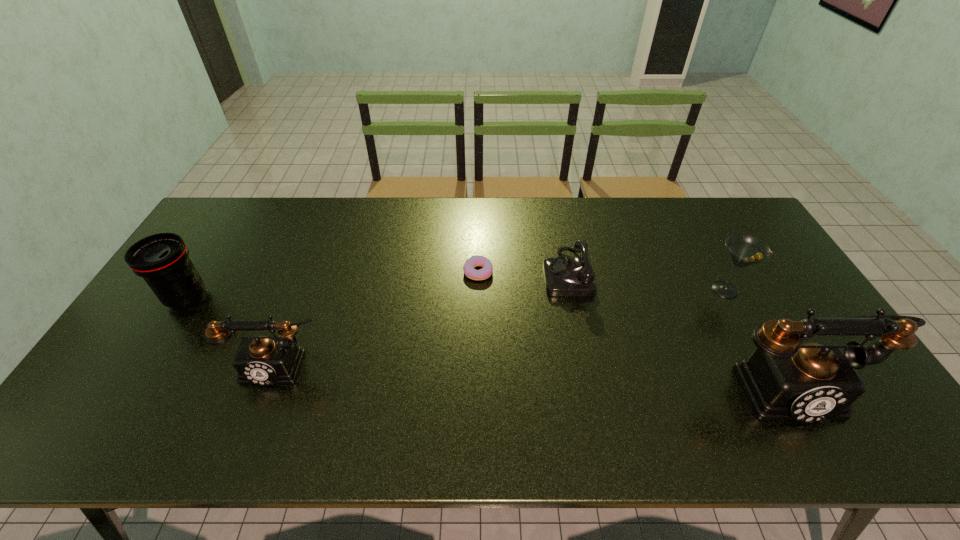
To achieve even spacing by inserting another telephone among them, please point to a vacant spot for this new telephone. Please provide its 2D coordinates. Your answer should be formatted as a tuple, i.e. [(x, y)], where the tuple contains the x and y coordinates of a point satisfying the conditions above.

[(528, 374)]